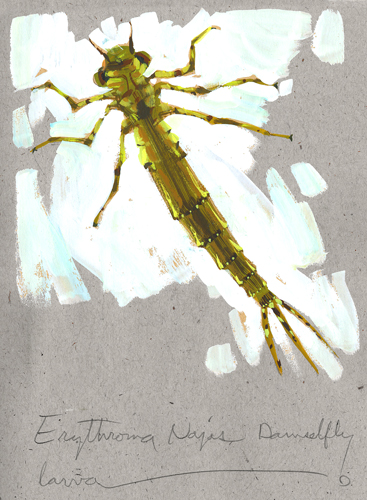
I want to click on gray canvas, so click(x=129, y=340).